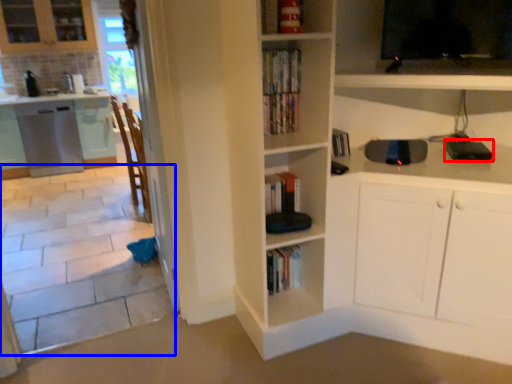
Question: Which of the following is the closest to the observer, appliance (highlighted by a red box) or tile (highlighted by a blue box)?

Choices:
 (A) appliance
 (B) tile

Answer: (B)